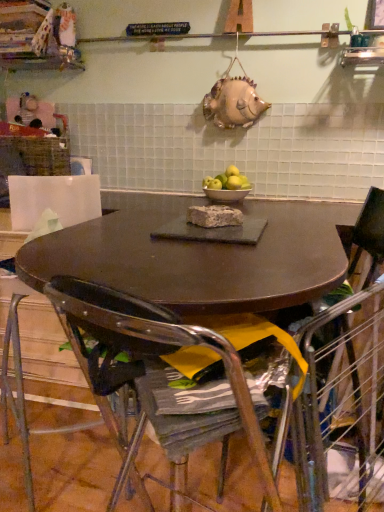
Question: From a real-world perspective, relative to metallic silver chair at lower center, the 1th chair from the front, is white ceramic bowl at center vertically above or below?

Choices:
 (A) above
 (B) below

Answer: (A)

Question: Would you say white ceramic bowl at center is to the left or to the right of metallic silver chair at lower center, marked as the second chair in a back-to-front arrangement, in the picture?

Choices:
 (A) left
 (B) right

Answer: (B)

Question: Which object is positioned farthest from the metallic wire chair at lower right, the 1th chair from the back?

Choices:
 (A) metallic silver chair at lower center, marked as the second chair in a back-to-front arrangement
 (B) brown crumbly cake at center
 (C) metallic wire armchair at lower right
 (D) white ceramic bowl at center
 (E) yellow matte apples at center

Answer: (E)

Question: Which object is positioned closest to the brown crumbly cake at center?

Choices:
 (A) metallic silver chair at lower center, the 1th chair from the front
 (B) metallic wire chair at lower right, the 2th chair from the front
 (C) yellow matte apples at center
 (D) metallic wire armchair at lower right
 (E) white ceramic bowl at center

Answer: (B)